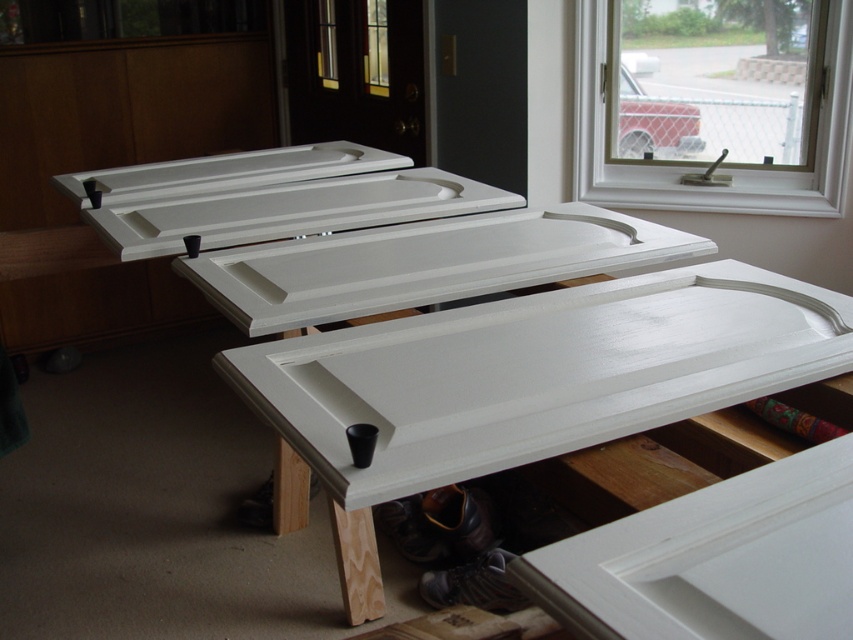
Question: Where is white painted wood door at center located in relation to white plastic window at upper right in the image?

Choices:
 (A) below
 (B) above

Answer: (A)

Question: Which object appears closest to the camera in this image?

Choices:
 (A) white plastic window at upper right
 (B) white painted wood door at center

Answer: (B)

Question: Is white painted wood door at center closer to the viewer compared to white plastic window at upper right?

Choices:
 (A) no
 (B) yes

Answer: (B)

Question: In this image, where is white painted wood door at center located relative to white plastic window at upper right?

Choices:
 (A) below
 (B) above

Answer: (A)